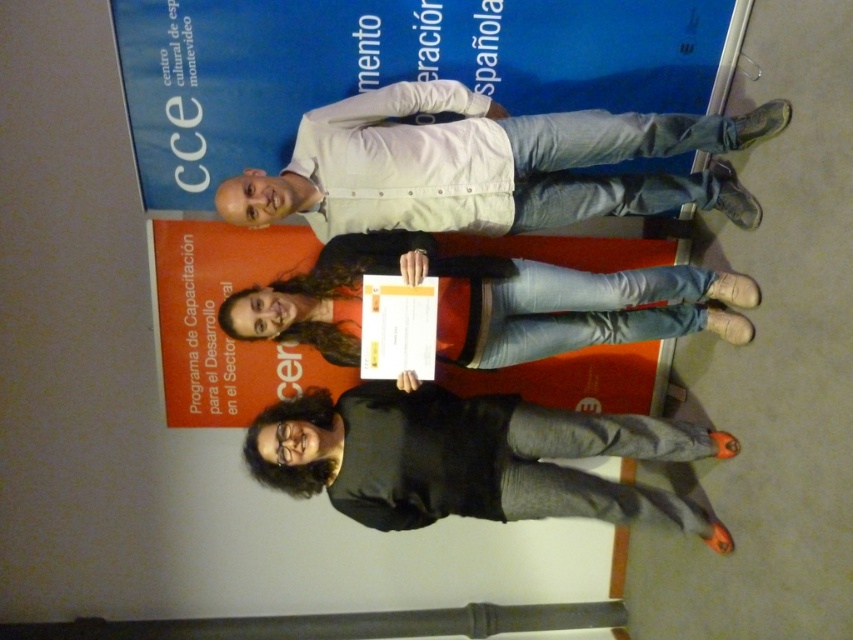
Is white cotton shirt at center smaller than black matte shirt at center?

Yes, white cotton shirt at center is smaller than black matte shirt at center.

Does point (434, 145) lie behind point (260, 477)?

No, it is not.

Where is `white cotton shirt at center`? The width and height of the screenshot is (853, 640). white cotton shirt at center is located at coordinates (485, 164).

Does blue paper at upper center have a smaller size compared to black matte shirt at center?

Actually, blue paper at upper center might be larger than black matte shirt at center.

Locate an element on the screen. This screenshot has width=853, height=640. blue paper at upper center is located at coordinates (392, 67).

Which is more to the left, white cotton shirt at center or denim jeans at center?

Positioned to the left is denim jeans at center.

The height and width of the screenshot is (640, 853). I want to click on white cotton shirt at center, so click(x=485, y=164).